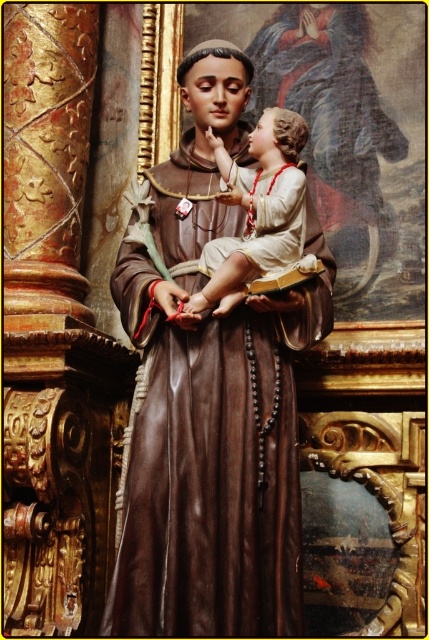
Question: Can you confirm if matte brown statue at center is wider than smooth beige fabric at center?

Choices:
 (A) yes
 (B) no

Answer: (A)

Question: Is matte brown statue at center to the left of smooth beige fabric at center from the viewer's perspective?

Choices:
 (A) yes
 (B) no

Answer: (B)

Question: Which of the following is the farthest from the observer?

Choices:
 (A) smooth beige fabric at center
 (B) matte brown statue at center

Answer: (A)

Question: Considering the relative positions of matte brown statue at center and smooth beige fabric at center in the image provided, where is matte brown statue at center located with respect to smooth beige fabric at center?

Choices:
 (A) below
 (B) above

Answer: (B)

Question: Which point is closer to the camera taking this photo?

Choices:
 (A) (126, 310)
 (B) (211, 262)

Answer: (B)

Question: Among these objects, which one is farthest from the camera?

Choices:
 (A) matte brown statue at center
 (B) smooth beige fabric at center

Answer: (B)